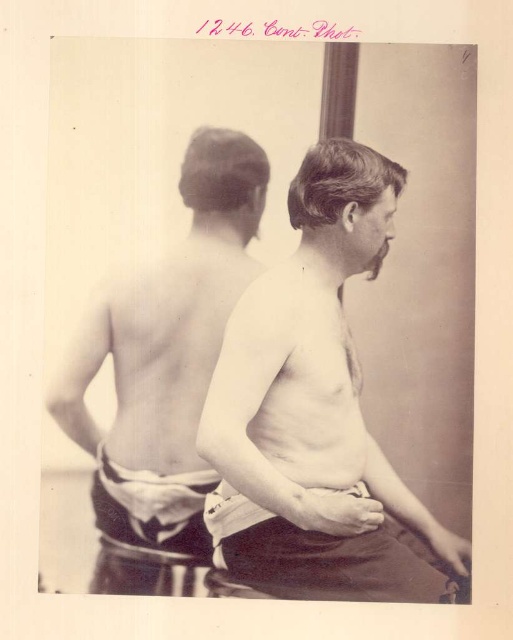
From the picture: Is smooth skin torso at center wider than white cotton underclothes at lower center?

Indeed, smooth skin torso at center has a greater width compared to white cotton underclothes at lower center.

Can you confirm if smooth skin torso at center is positioned above white cotton underclothes at lower center?

Yes.

Who is more forward, (306, 515) or (161, 525)?

Point (306, 515)

This screenshot has width=513, height=640. What are the coordinates of `smooth skin torso at center` in the screenshot? It's located at (314, 413).

Based on the photo, does smooth skin torso at center have a lesser height compared to smooth skin man at center?

Indeed, smooth skin torso at center has a lesser height compared to smooth skin man at center.

Is smooth skin torso at center below smooth skin man at center?

Correct, smooth skin torso at center is located below smooth skin man at center.

Which is in front, point (408, 502) or point (207, 252)?

Point (408, 502) is in front.

At what (x,y) coordinates should I click in order to perform the action: click on smooth skin torso at center. Please return your answer as a coordinate pair (x, y). Image resolution: width=513 pixels, height=640 pixels. Looking at the image, I should click on (314, 413).

Does point (249, 230) come in front of point (174, 502)?

No, it is not.

Does smooth skin man at center have a larger size compared to white cotton underclothes at lower center?

Yes, smooth skin man at center is bigger than white cotton underclothes at lower center.

Which is behind, point (156, 348) or point (185, 486)?

The point (156, 348) is behind.

This screenshot has width=513, height=640. I want to click on smooth skin man at center, so click(166, 371).